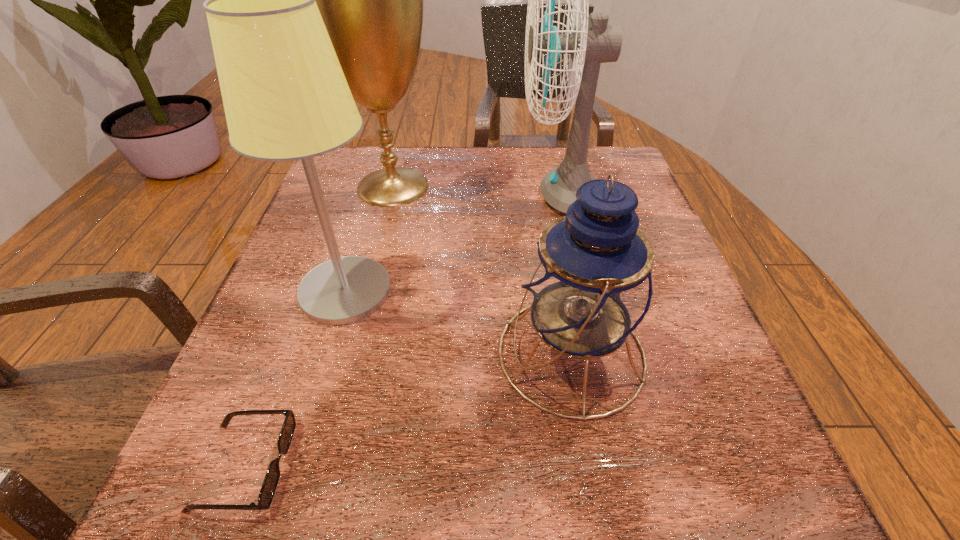
The width and height of the screenshot is (960, 540). Identify the location of free point located 0.150m on the front-facing side of the lantern. (403, 353).

This screenshot has width=960, height=540. I want to click on vacant space located on the front-facing side of the lantern, so click(359, 353).

The height and width of the screenshot is (540, 960). What are the coordinates of `vacant space located on the front-facing side of the lantern` in the screenshot? It's located at [257, 353].

Where is `vacant space located 0.390m on the front-facing side of the shortest object`? The height and width of the screenshot is (540, 960). vacant space located 0.390m on the front-facing side of the shortest object is located at coordinates (590, 465).

The height and width of the screenshot is (540, 960). I want to click on fan located in the far edge section of the desktop, so click(x=590, y=43).

Locate an element on the screen. The height and width of the screenshot is (540, 960). trophy cup present at the far edge is located at coordinates (371, 0).

This screenshot has width=960, height=540. Find the location of `object that is at the near edge`. object that is at the near edge is located at coordinates (272, 476).

Image resolution: width=960 pixels, height=540 pixels. In order to click on table lamp that is at the left edge in this screenshot , I will do `click(285, 96)`.

Where is `trophy cup that is at the left edge`? trophy cup that is at the left edge is located at coordinates (371, 0).

At what (x,y) coordinates should I click in order to perform the action: click on sunglasses that is at the left edge. Please return your answer as a coordinate pair (x, y). This screenshot has width=960, height=540. Looking at the image, I should click on (272, 476).